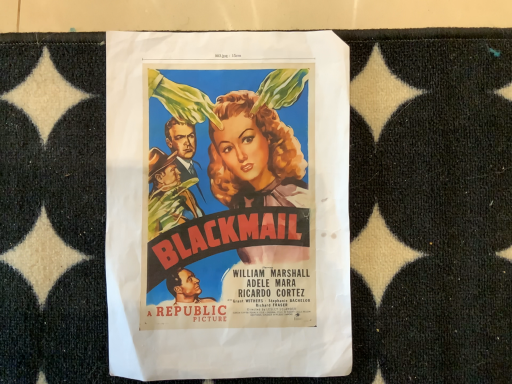
Locate an element on the screen. Image resolution: width=512 pixels, height=384 pixels. free space above matte paper poster at center (from a real-world perspective) is located at coordinates (228, 206).